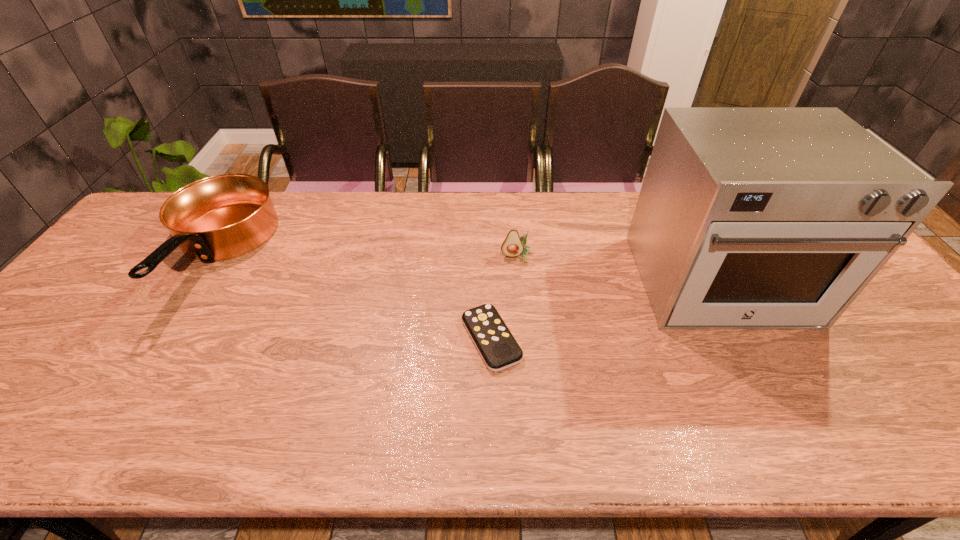
At what (x,y) coordinates should I click in order to perform the action: click on vacant area that lies between the avocado and the second tallest object. Please return your answer as a coordinate pair (x, y). This screenshot has height=540, width=960. Looking at the image, I should click on (367, 256).

The height and width of the screenshot is (540, 960). Identify the location of free space between the tallest object and the remote control. (605, 311).

In order to click on free spot between the frying pan and the avocado in this screenshot , I will do [367, 256].

Locate an element on the screen. free space between the leftmost object and the tallest object is located at coordinates (467, 269).

The width and height of the screenshot is (960, 540). In order to click on vacant area that lies between the tallest object and the frying pan in this screenshot , I will do `click(467, 269)`.

Where is `free space between the avocado and the second tallest object`? The image size is (960, 540). free space between the avocado and the second tallest object is located at coordinates (367, 256).

Locate an element on the screen. free area in between the leftmost object and the rightmost object is located at coordinates (467, 269).

In order to click on vacant space that is in between the remote control and the leftmost object in this screenshot , I will do `click(353, 298)`.

I want to click on object that stands as the second closest to the third tallest object, so click(749, 218).

Image resolution: width=960 pixels, height=540 pixels. I want to click on object that is the closest to the second shortest object, so click(499, 350).